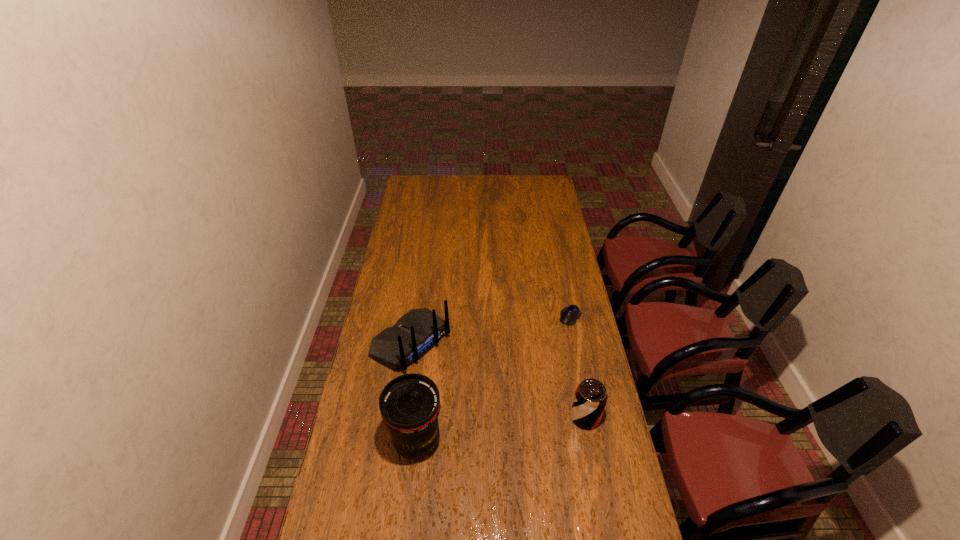
Where is `free space located 0.330m on the back of the third shortest object`? The image size is (960, 540). free space located 0.330m on the back of the third shortest object is located at coordinates (508, 414).

Identify the location of vacant region located 0.400m on the back of the third shortest object. The image size is (960, 540). (524, 426).

The image size is (960, 540). What are the coordinates of `telephoto lens present at the left edge` in the screenshot? It's located at (409, 404).

The image size is (960, 540). Identify the location of router located at the left edge. (414, 334).

Where is `soda can that is positioned at the right edge`? soda can that is positioned at the right edge is located at coordinates (590, 399).

The image size is (960, 540). In order to click on computer mouse located at the right edge in this screenshot , I will do `click(569, 315)`.

At what (x,y) coordinates should I click in order to perform the action: click on vacant space at the far edge of the desktop. Please return your answer as a coordinate pair (x, y). Looking at the image, I should click on (519, 180).

This screenshot has height=540, width=960. I want to click on blank space at the near edge of the desktop, so click(497, 531).

The width and height of the screenshot is (960, 540). Find the location of `vacant space at the left edge of the desktop`. vacant space at the left edge of the desktop is located at coordinates (408, 209).

I want to click on vacant space at the right edge, so click(x=613, y=482).